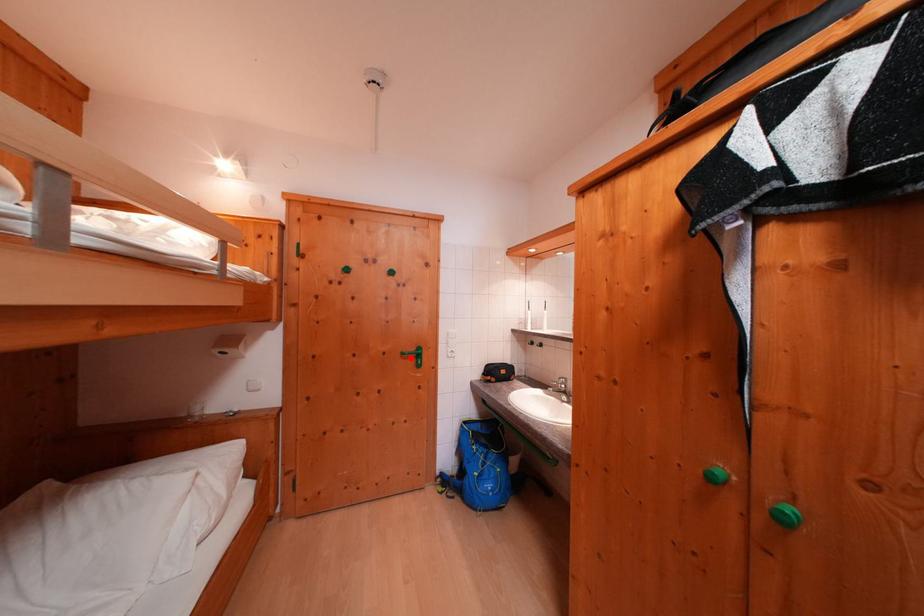
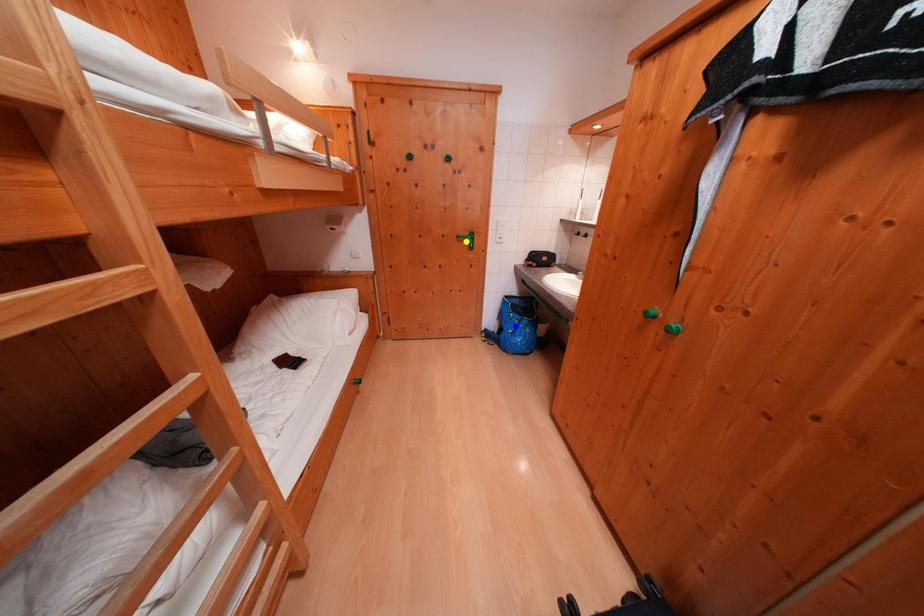
Question: I am providing you with two images of the same scene from different viewpoints. A red point is marked on the first image. You are given multiple points on the second image. Which spot in image 2 lines up with the point in image 1?

Choices:
 (A) green point
 (B) blue point
 (C) yellow point

Answer: (C)